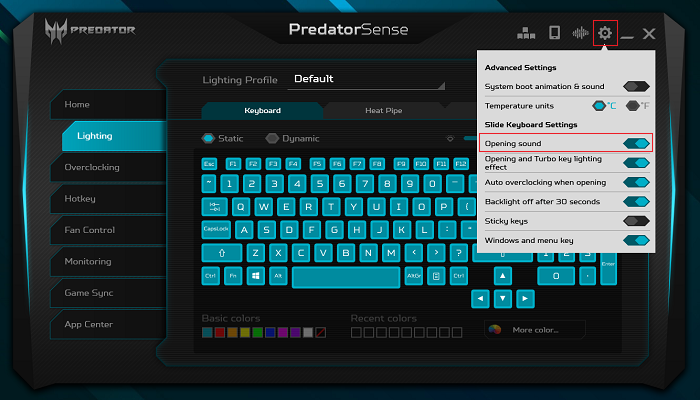
You are a GUI agent. You are given a task and a screenshot of the screen. Output one action in this format:
    pyautogui.click(x=<x>, y=<y>)
    Task: Click on the lighting button highlighted in blue
    
    Given the screenshot: What is the action you would take?
    pyautogui.click(x=105, y=136)